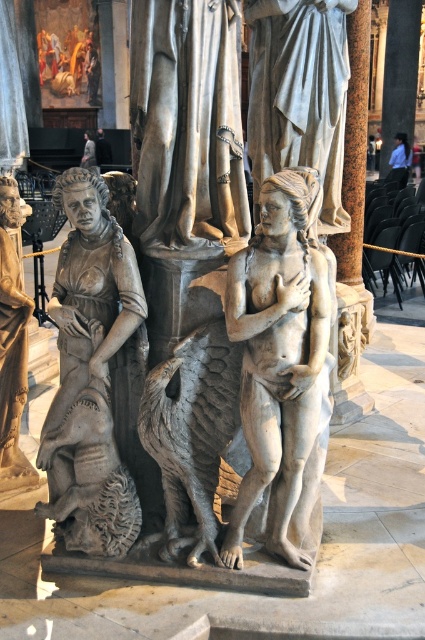
You are an interior designer assessing the spatial arrangement of the marble sculpture and its surroundings. Given the presence of the smooth stone column at center and the blue fabric shirt at upper right, which object is positioned higher in the scene?

The smooth stone column at center is positioned higher than the blue fabric shirt at upper right.